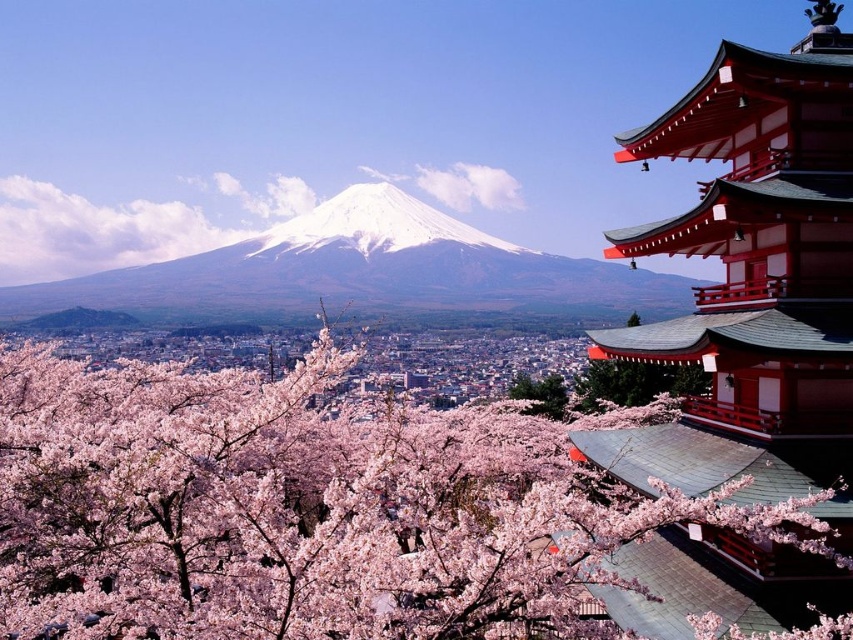
Question: Does pink blossoms at center appear on the left side of white snow-covered mountain at center?

Choices:
 (A) yes
 (B) no

Answer: (B)

Question: Which of the following is the farthest from the observer?

Choices:
 (A) (294, 404)
 (B) (532, 397)
 (C) (428, 212)
 (D) (370, 189)

Answer: (C)

Question: Is pink blossoms at center bigger than white snow-covered mountain at center?

Choices:
 (A) yes
 (B) no

Answer: (B)

Question: Which object is the farthest from the white snow-covered mountain at center?

Choices:
 (A) pink blossoms at center
 (B) white snow-covered mountain at upper left

Answer: (A)

Question: Which object is the closest to the pink blossoms at center?

Choices:
 (A) white snow-covered mountain at upper left
 (B) green leafy tree at center
 (C) white snow-covered mountain at center

Answer: (B)

Question: Is pink blossoms at center above white snow-covered mountain at upper left?

Choices:
 (A) yes
 (B) no

Answer: (B)